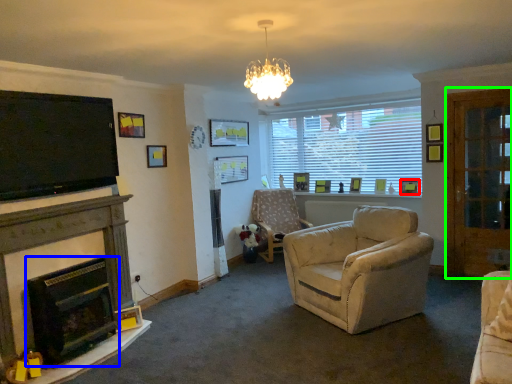
Question: Which object is the closest to the picture frame (highlighted by a red box)? Choose among these: fireplace (highlighted by a blue box) or glass door (highlighted by a green box).

Choices:
 (A) fireplace
 (B) glass door

Answer: (B)